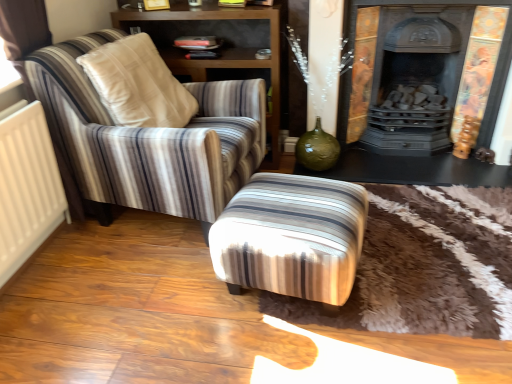
Question: Does striped fabric armchair at left lie in front of dark gray cast iron fireplace at upper right?

Choices:
 (A) yes
 (B) no

Answer: (A)

Question: Is dark gray cast iron fireplace at upper right at the back of striped fabric armchair at left?

Choices:
 (A) yes
 (B) no

Answer: (B)

Question: Is striped fabric armchair at left in contact with dark gray cast iron fireplace at upper right?

Choices:
 (A) yes
 (B) no

Answer: (B)

Question: Would you say striped fabric armchair at left is outside dark gray cast iron fireplace at upper right?

Choices:
 (A) no
 (B) yes

Answer: (B)

Question: Does striped fabric armchair at left have a greater height compared to dark gray cast iron fireplace at upper right?

Choices:
 (A) yes
 (B) no

Answer: (B)

Question: Considering their positions, is striped fabric ottoman at center located in front of or behind striped fabric armchair at left?

Choices:
 (A) behind
 (B) front

Answer: (B)

Question: Is striped fabric ottoman at center wider or thinner than striped fabric armchair at left?

Choices:
 (A) thin
 (B) wide

Answer: (A)

Question: Considering the positions of striped fabric ottoman at center and striped fabric armchair at left in the image, is striped fabric ottoman at center taller or shorter than striped fabric armchair at left?

Choices:
 (A) tall
 (B) short

Answer: (B)

Question: Is striped fabric ottoman at center inside or outside of striped fabric armchair at left?

Choices:
 (A) inside
 (B) outside

Answer: (B)

Question: Looking at their shapes, would you say dark gray cast iron fireplace at upper right is wider or thinner than wooden shelf at upper left?

Choices:
 (A) thin
 (B) wide

Answer: (A)

Question: From the image's perspective, is dark gray cast iron fireplace at upper right above or below wooden shelf at upper left?

Choices:
 (A) below
 (B) above

Answer: (A)

Question: Based on their sizes in the image, would you say dark gray cast iron fireplace at upper right is bigger or smaller than wooden shelf at upper left?

Choices:
 (A) big
 (B) small

Answer: (B)

Question: From a real-world perspective, relative to wooden shelf at upper left, is dark gray cast iron fireplace at upper right vertically above or below?

Choices:
 (A) above
 (B) below

Answer: (A)

Question: Considering the positions of white matte radiator at left and striped fabric ottoman at center in the image, is white matte radiator at left wider or thinner than striped fabric ottoman at center?

Choices:
 (A) thin
 (B) wide

Answer: (A)

Question: Considering the relative positions of white matte radiator at left and striped fabric ottoman at center in the image provided, is white matte radiator at left to the left or to the right of striped fabric ottoman at center?

Choices:
 (A) right
 (B) left

Answer: (B)